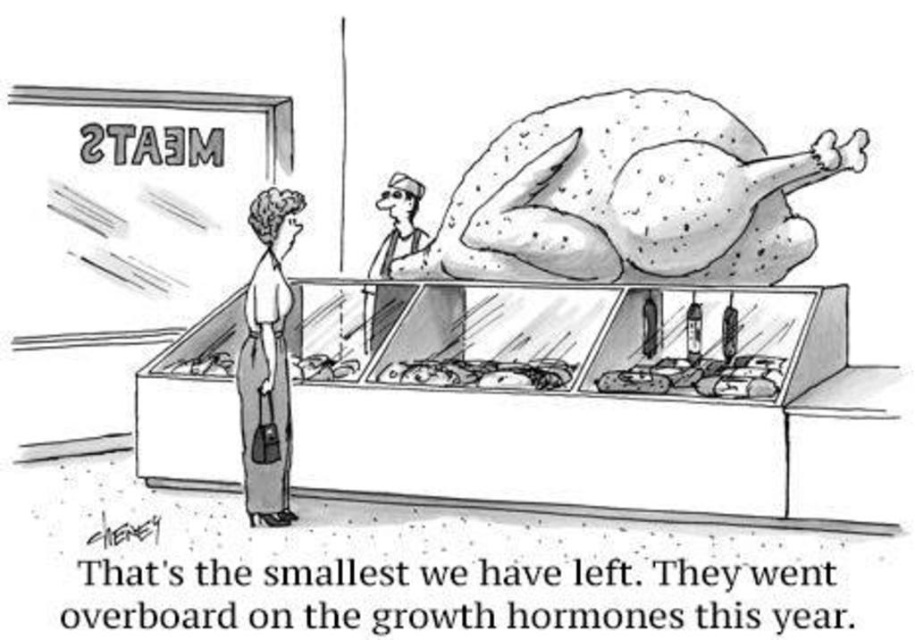
Question: Which of the following is the farthest from the observer?

Choices:
 (A) (246, 284)
 (B) (612, 388)
 (C) (521, 156)
 (D) (434, 372)

Answer: (C)

Question: Which object is farther from the camera taking this photo?

Choices:
 (A) smooth white meat at center
 (B) smooth beige pants at lower left
 (C) speckled white turkey at center

Answer: (C)

Question: Does smooth white meat at center have a greater width compared to smooth skin worker at upper center?

Choices:
 (A) yes
 (B) no

Answer: (A)

Question: Which object appears farthest from the camera in this image?

Choices:
 (A) smooth beige pants at lower left
 (B) smooth white meat at center

Answer: (A)

Question: Can you confirm if smooth beige pants at lower left is smaller than smooth skin worker at upper center?

Choices:
 (A) yes
 (B) no

Answer: (B)

Question: Can you confirm if speckled white turkey at center is bigger than smooth beige pants at lower left?

Choices:
 (A) no
 (B) yes

Answer: (B)